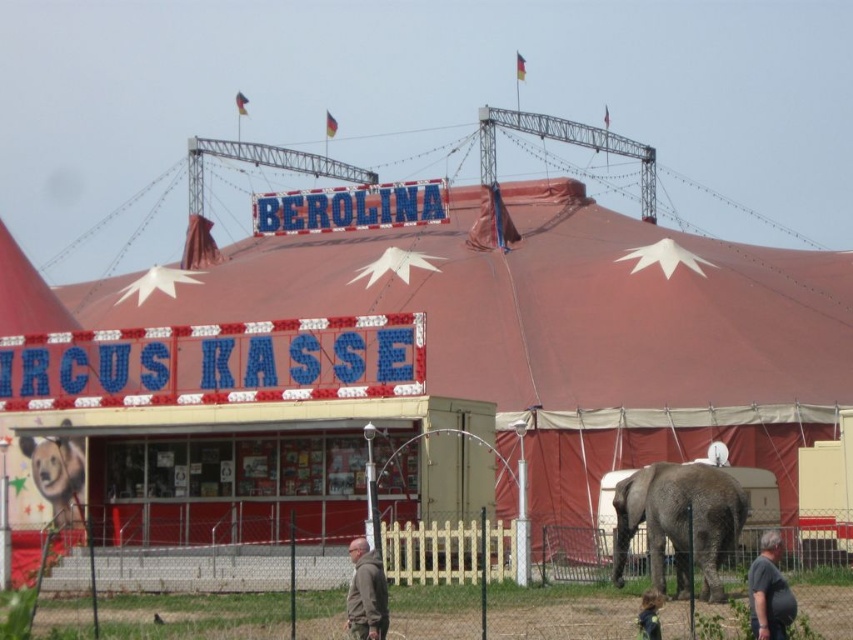
You are a visitor at the Berolina Circus and want to buy tickets. You see the red canvas tent at center and the brown plush bear at lower left. Which object is taller?

The red canvas tent at center is taller than the brown plush bear at lower left.

From the picture: You are standing at the entrance of the Berolina Circus and want to buy tickets. Which object should you approach first, the red canvas tent at center or the ticket booth labeled Circus Kasse?

The ticket booth labeled Circus Kasse is not listed in the provided objects. The only object mentioned is the red canvas tent at center. Therefore, based on the given information, you should approach the red canvas tent at center first.